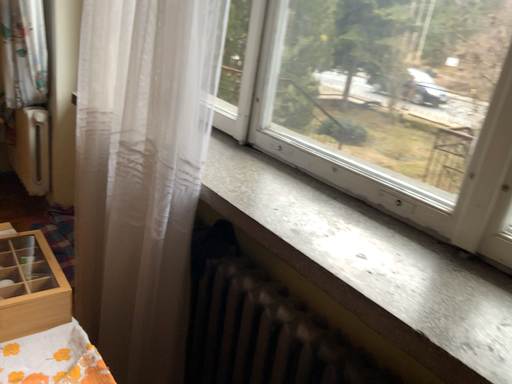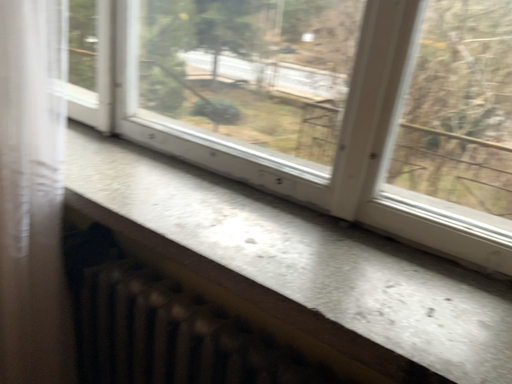
Question: Which way did the camera rotate in the video?

Choices:
 (A) rotated left
 (B) rotated right

Answer: (B)